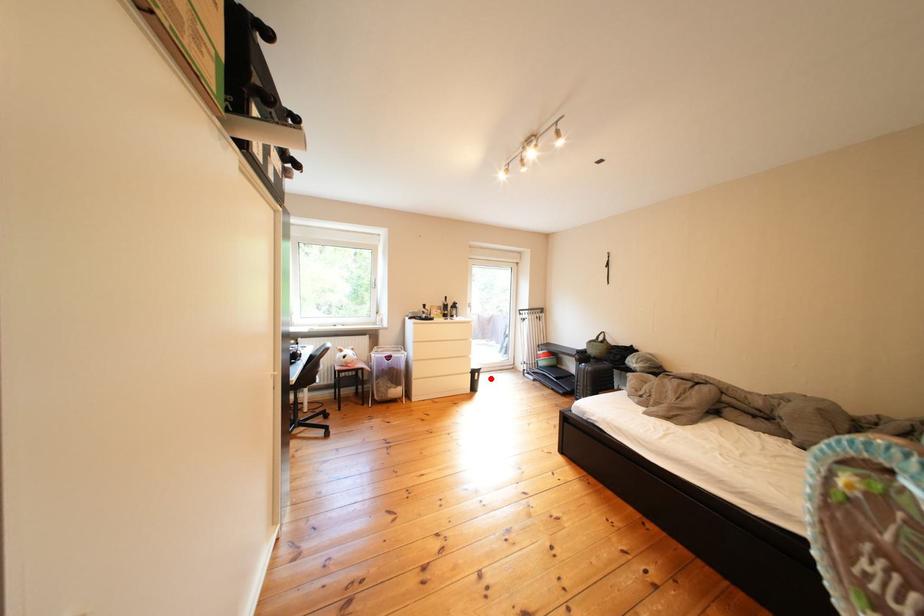
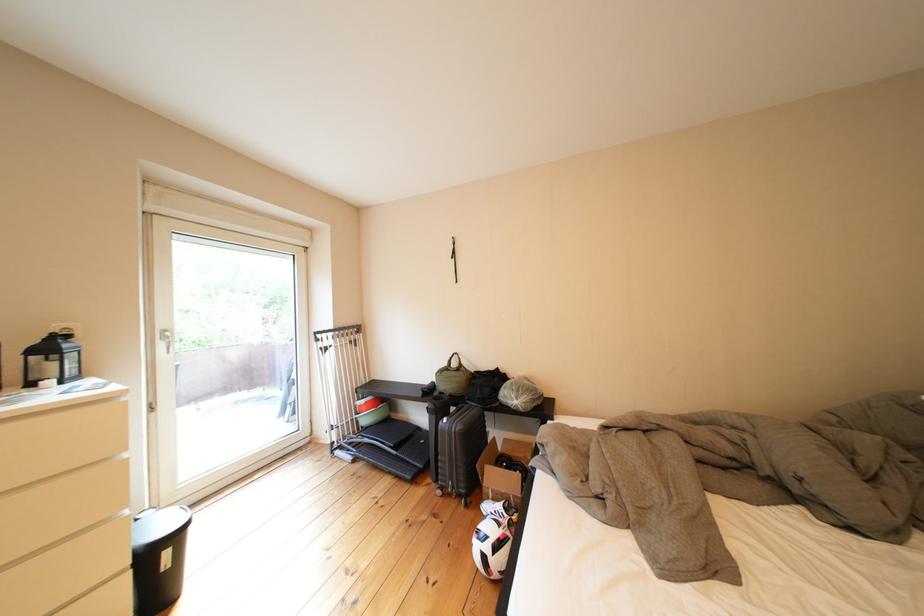
Where in the second image is the point corresponding to the highlighted location from the first image?

(179, 557)